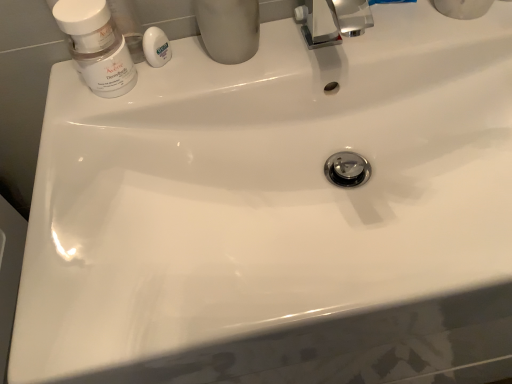
Locate an element on the screen. vacant space in front of matte white jar at upper left is located at coordinates (81, 180).